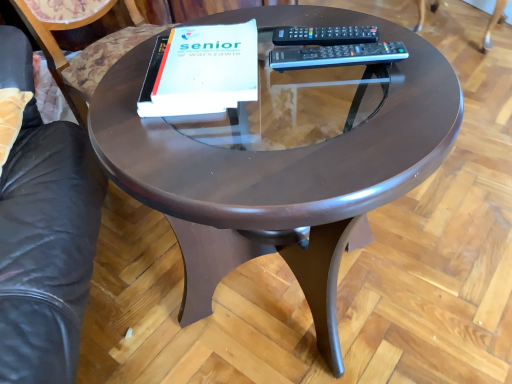
Question: Considering the relative sizes of black plastic remote at upper right, which is the second remote in back-to-front order, and shiny brown table at center in the image provided, is black plastic remote at upper right, which is the second remote in back-to-front order, thinner than shiny brown table at center?

Choices:
 (A) yes
 (B) no

Answer: (A)

Question: Is black plastic remote at upper right, which ranks as the first remote in bottom-to-top order, at the right side of shiny brown table at center?

Choices:
 (A) no
 (B) yes

Answer: (A)

Question: Is the depth of black plastic remote at upper right, the first remote when ordered from front to back, less than that of shiny brown table at center?

Choices:
 (A) yes
 (B) no

Answer: (A)

Question: Is black plastic remote at upper right, the first remote when ordered from front to back, oriented away from shiny brown table at center?

Choices:
 (A) no
 (B) yes

Answer: (A)

Question: Is the surface of black plastic remote at upper right, which ranks as the first remote in bottom-to-top order, in direct contact with shiny brown table at center?

Choices:
 (A) yes
 (B) no

Answer: (B)

Question: Can we say black plastic remote at upper right, which is the second remote in back-to-front order, lies outside shiny brown table at center?

Choices:
 (A) no
 (B) yes

Answer: (B)

Question: Considering the relative positions of white matte paper at center and black plastic remote at upper right, placed as the second remote when sorted from bottom to top, in the image provided, is white matte paper at center to the left of black plastic remote at upper right, placed as the second remote when sorted from bottom to top, from the viewer's perspective?

Choices:
 (A) yes
 (B) no

Answer: (A)

Question: Is the depth of white matte paper at center less than that of black plastic remote at upper right, the first remote in the top-to-bottom sequence?

Choices:
 (A) no
 (B) yes

Answer: (B)

Question: From a real-world perspective, is white matte paper at center positioned over black plastic remote at upper right, the second remote viewed from the front, based on gravity?

Choices:
 (A) no
 (B) yes

Answer: (B)

Question: From the image's perspective, is white matte paper at center beneath black plastic remote at upper right, placed as the second remote when sorted from bottom to top?

Choices:
 (A) yes
 (B) no

Answer: (A)

Question: Is white matte paper at center facing away from black plastic remote at upper right, the first remote in the top-to-bottom sequence?

Choices:
 (A) yes
 (B) no

Answer: (B)

Question: Can you confirm if white matte paper at center is shorter than black plastic remote at upper right, the first remote in the top-to-bottom sequence?

Choices:
 (A) yes
 (B) no

Answer: (B)

Question: Is shiny brown table at center a part of wooden swivel chair at upper right?

Choices:
 (A) no
 (B) yes

Answer: (A)